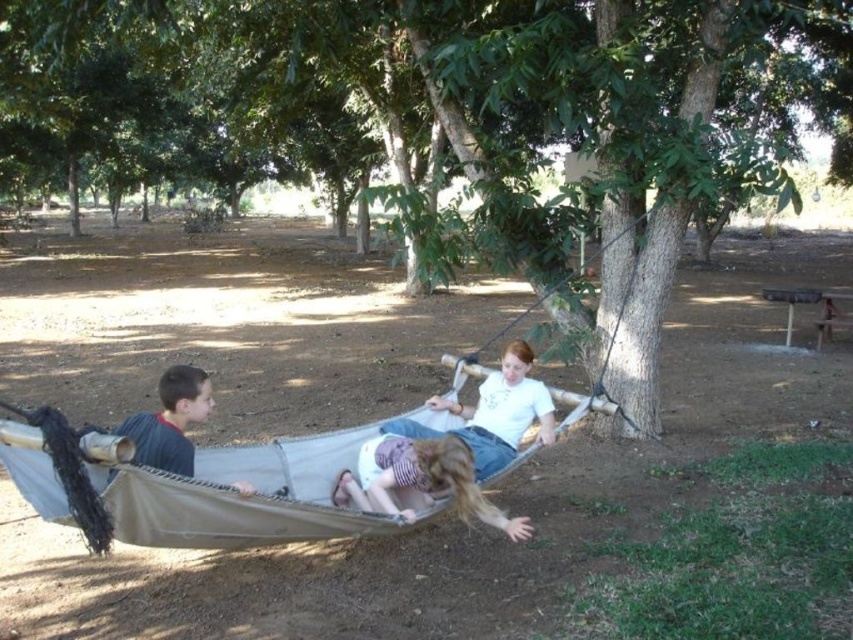
Consider the image. Who is positioned more to the left, beige canvas hammock at center or light purple fabric hammock at center?

From the viewer's perspective, beige canvas hammock at center appears more on the left side.

Is point (125, 432) closer to camera compared to point (485, 502)?

Yes, it is in front of point (485, 502).

At what (x,y) coordinates should I click in order to perform the action: click on beige canvas hammock at center. Please return your answer as a coordinate pair (x, y). This screenshot has height=640, width=853. Looking at the image, I should click on (195, 486).

Is point (677, 243) closer to camera compared to point (157, 448)?

No, it is not.

Which is more to the right, green leafy tree at center or gray fabric hammock at left?

gray fabric hammock at left is more to the right.

Which is in front, point (602, 205) or point (173, 381)?

Point (173, 381)

The height and width of the screenshot is (640, 853). I want to click on green leafy tree at center, so click(456, 131).

Can you confirm if beige canvas hammock at center is positioned to the left of gray fabric hammock at left?

Incorrect, beige canvas hammock at center is not on the left side of gray fabric hammock at left.

Which is in front, point (408, 412) or point (163, 445)?

Point (163, 445) is in front.

What are the coordinates of `beige canvas hammock at center` in the screenshot? It's located at (195, 486).